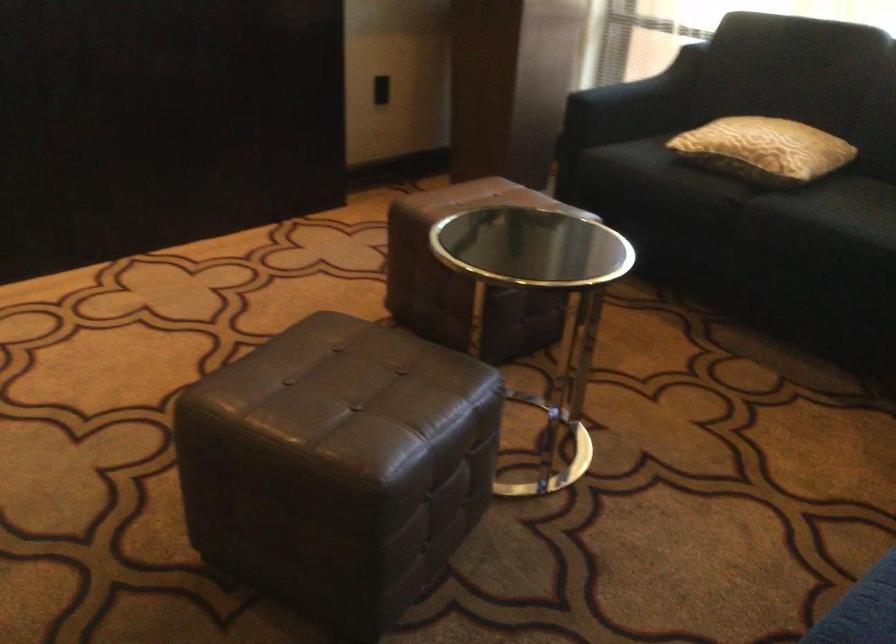
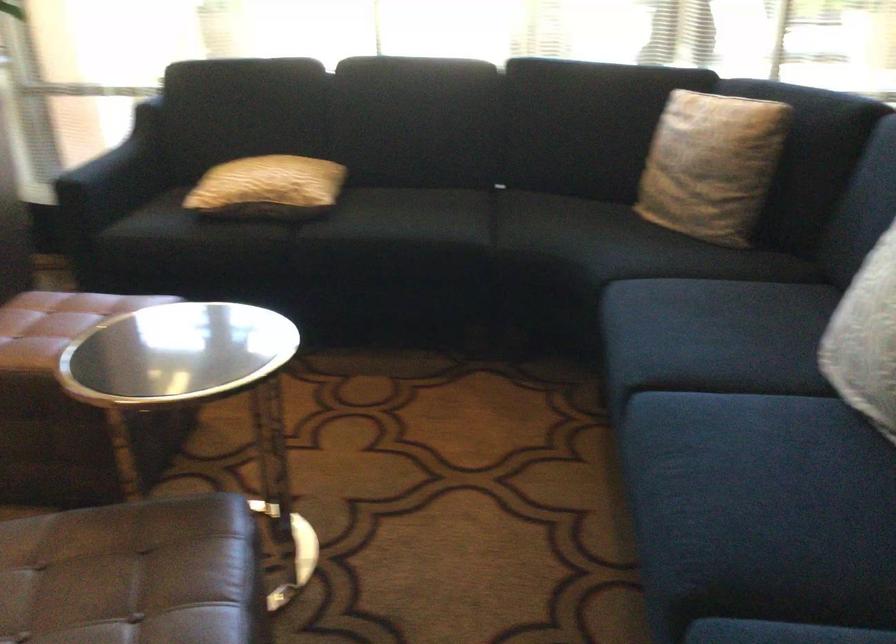
The point at (373,386) is marked in the first image. Where is the corresponding point in the second image?

(134, 574)